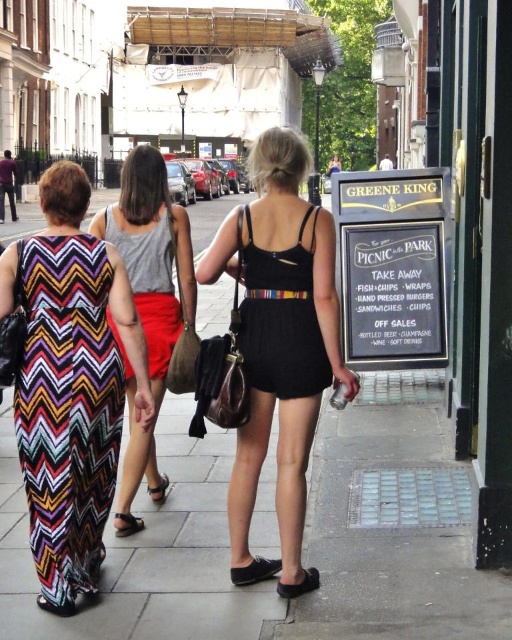
Question: Which is nearer to the black chalkboard sign at right?

Choices:
 (A) smooth concrete pavement at center
 (B) black leather sandal at lower left
 (C) red satin dress at center

Answer: (A)

Question: In this image, where is black textured dress at center located relative to black suede shoe at lower center?

Choices:
 (A) right
 (B) left

Answer: (A)

Question: Which object is closer to the camera taking this photo?

Choices:
 (A) black chalkboard sign at right
 (B) black suede sandal at lower center

Answer: (B)

Question: Considering the real-world distances, which object is closest to the multicolored zigzag fabric dress at center?

Choices:
 (A) black leather sandal at lower left
 (B) black suede sandal at lower center

Answer: (A)

Question: Considering the relative positions of black satin dress at center and matte black sandal at lower left in the image provided, where is black satin dress at center located with respect to matte black sandal at lower left?

Choices:
 (A) above
 (B) below

Answer: (A)

Question: In this image, where is multicolored zigzag dress at center located relative to matte black sandal at lower left?

Choices:
 (A) left
 (B) right

Answer: (B)